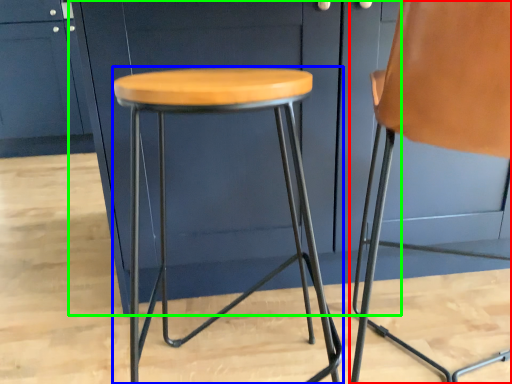
Question: Which object is the closest to the chair (highlighted by a red box)? Choose among these: stool (highlighted by a blue box) or cabinetry (highlighted by a green box).

Choices:
 (A) stool
 (B) cabinetry

Answer: (A)